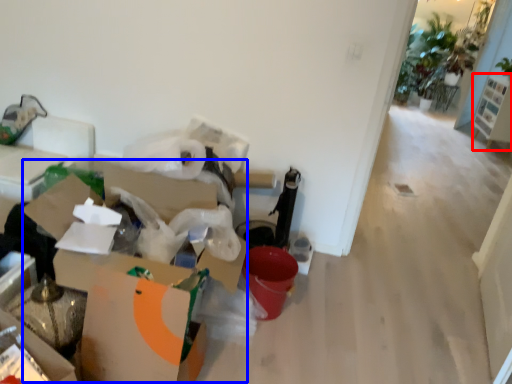
Question: Which object is closer to the camera taking this photo, furniture (highlighted by a red box) or cardboard box (highlighted by a blue box)?

Choices:
 (A) furniture
 (B) cardboard box

Answer: (B)